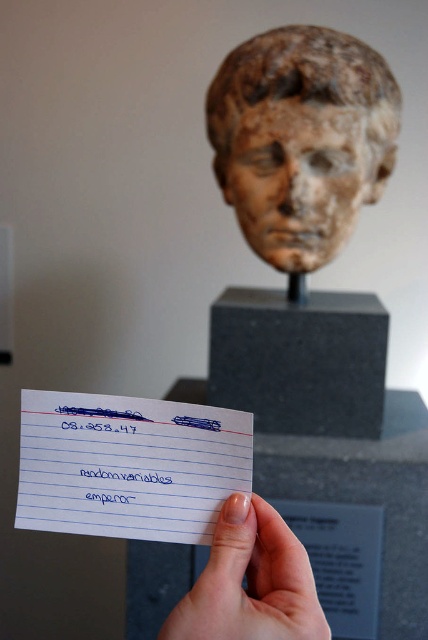
Question: Which of these objects is positioned farthest from the pale skin at center?

Choices:
 (A) white lined paper at center
 (B) speckled stone head at upper center
 (C) blue ink signature at center

Answer: (B)

Question: Does speckled stone head at upper center appear on the left side of blue ink signature at center?

Choices:
 (A) no
 (B) yes

Answer: (A)

Question: Which point appears farthest from the camera in this image?

Choices:
 (A) (285, 118)
 (B) (70, 481)

Answer: (A)

Question: Which point appears farthest from the camera in this image?

Choices:
 (A) (183, 636)
 (B) (174, 506)

Answer: (B)

Question: Observing the image, what is the correct spatial positioning of white lined paper at center in reference to blue ink signature at center?

Choices:
 (A) left
 (B) right

Answer: (B)

Question: Does white lined paper at center have a larger size compared to blue ink signature at center?

Choices:
 (A) yes
 (B) no

Answer: (A)